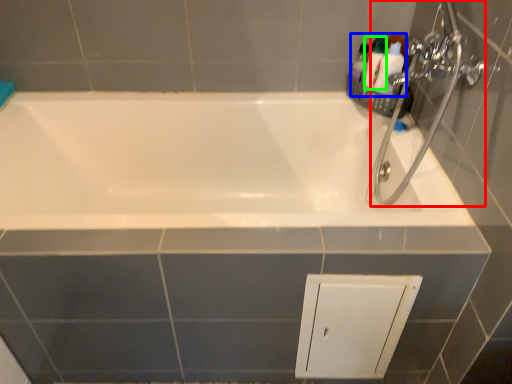
Question: Estimate the real-world distances between objects in this image. Which object is farther from plumbing fixture (highlighted by a red box), toiletry (highlighted by a blue box) or toiletry (highlighted by a green box)?

Choices:
 (A) toiletry
 (B) toiletry

Answer: (B)